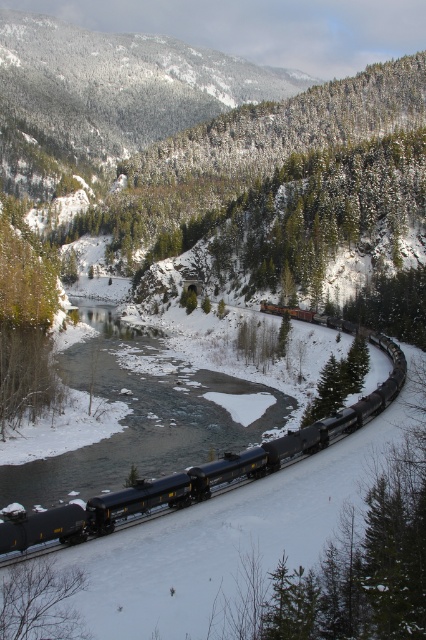
Question: Among these objects, which one is nearest to the camera?

Choices:
 (A) green textured pine at left
 (B) matte black train at lower center

Answer: (B)

Question: Does matte black train at lower center have a larger size compared to green textured pine at left?

Choices:
 (A) yes
 (B) no

Answer: (B)

Question: From the image, what is the correct spatial relationship of matte black train at lower center in relation to green textured pine at left?

Choices:
 (A) right
 (B) left

Answer: (A)

Question: Among these points, which one is nearest to the camera?

Choices:
 (A) (3, 314)
 (B) (262, 460)

Answer: (B)

Question: Which point appears farthest from the camera in this image?

Choices:
 (A) (48, 397)
 (B) (109, 522)

Answer: (A)

Question: Does matte black train at lower center appear on the right side of green textured pine at left?

Choices:
 (A) yes
 (B) no

Answer: (A)